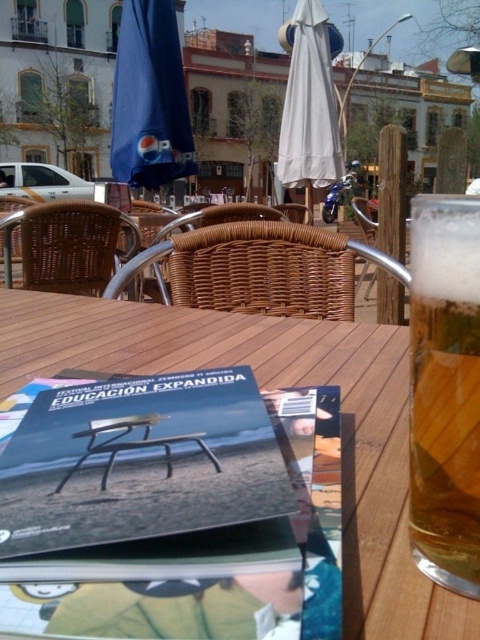
Question: Which point appears closest to the camera in this image?

Choices:
 (A) (437, 483)
 (B) (311, 145)

Answer: (A)

Question: Which point appears closest to the camera in this image?

Choices:
 (A) (110, 472)
 (B) (124, 29)
 (C) (342, 36)

Answer: (A)

Question: Does golden amber liquid at right come behind white fabric umbrella at upper center?

Choices:
 (A) yes
 (B) no

Answer: (B)

Question: Based on their relative distances, which object is farther from the golden amber liquid at right?

Choices:
 (A) white fabric umbrella at upper center
 (B) matte black magazine at center
 (C) blue fabric umbrella at upper left
 (D) wooden table at center

Answer: (A)

Question: Can you confirm if wooden table at center is positioned to the left of white fabric umbrella at upper center?

Choices:
 (A) yes
 (B) no

Answer: (A)

Question: Where is golden amber liquid at right located in relation to blue fabric umbrella at upper left in the image?

Choices:
 (A) left
 (B) right

Answer: (B)